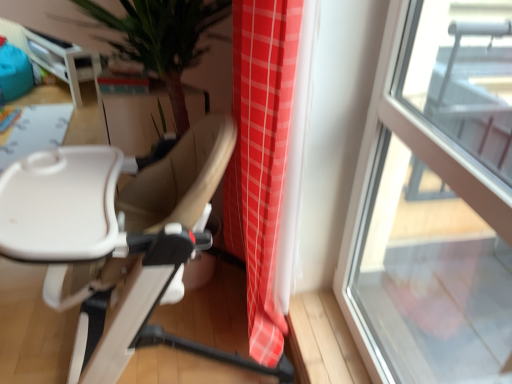
Question: From a real-world perspective, does white glossy table at upper left stand above transparent glass window at right?

Choices:
 (A) no
 (B) yes

Answer: (A)

Question: Is white glossy table at upper left positioned far away from transparent glass window at right?

Choices:
 (A) no
 (B) yes

Answer: (B)

Question: Considering the relative positions of white glossy table at upper left and transparent glass window at right in the image provided, is white glossy table at upper left to the right of transparent glass window at right from the viewer's perspective?

Choices:
 (A) no
 (B) yes

Answer: (A)

Question: Is white glossy table at upper left shorter than transparent glass window at right?

Choices:
 (A) no
 (B) yes

Answer: (B)

Question: Is white glossy table at upper left taller than transparent glass window at right?

Choices:
 (A) yes
 (B) no

Answer: (B)

Question: From a real-world perspective, relative to white glossy table at upper left, is transparent glass window at right vertically above or below?

Choices:
 (A) above
 (B) below

Answer: (A)

Question: Considering their positions, is transparent glass window at right located in front of or behind white glossy table at upper left?

Choices:
 (A) behind
 (B) front

Answer: (B)

Question: Is transparent glass window at right taller or shorter than white glossy table at upper left?

Choices:
 (A) tall
 (B) short

Answer: (A)

Question: In terms of width, does transparent glass window at right look wider or thinner when compared to white glossy table at upper left?

Choices:
 (A) thin
 (B) wide

Answer: (A)

Question: Would you say beige leather chair at center is to the left or to the right of white glossy table at upper left in the picture?

Choices:
 (A) left
 (B) right

Answer: (B)

Question: Is point (227, 140) positioned closer to the camera than point (69, 72)?

Choices:
 (A) farther
 (B) closer

Answer: (B)

Question: From the image's perspective, is beige leather chair at center positioned above or below white glossy table at upper left?

Choices:
 (A) below
 (B) above

Answer: (A)

Question: From their relative heights in the image, would you say beige leather chair at center is taller or shorter than white glossy table at upper left?

Choices:
 (A) short
 (B) tall

Answer: (A)

Question: From the image's perspective, relative to transparent glass window at right, is beige leather chair at center above or below?

Choices:
 (A) above
 (B) below

Answer: (A)

Question: From a real-world perspective, relative to transparent glass window at right, is beige leather chair at center vertically above or below?

Choices:
 (A) above
 (B) below

Answer: (B)